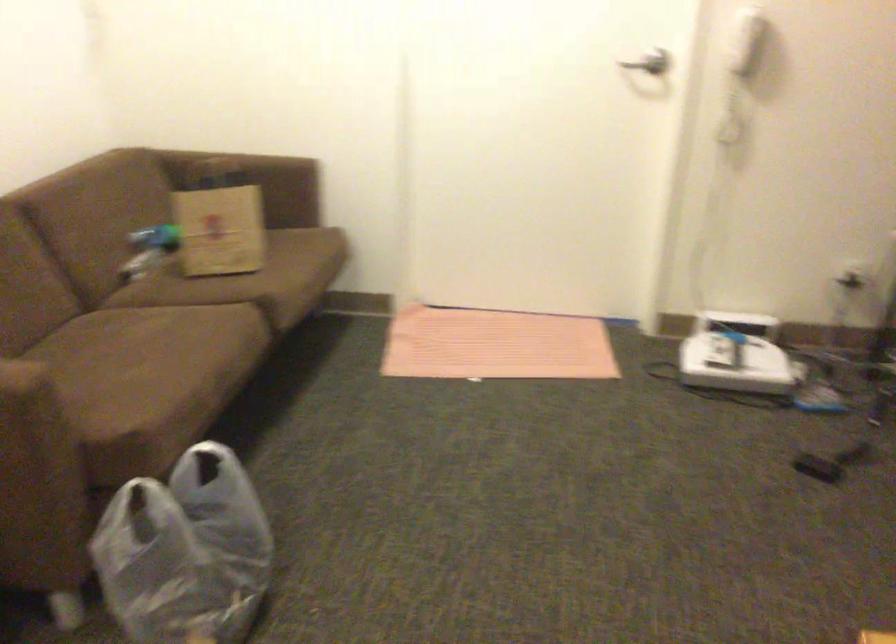
Where would you rest the brown sofa armrest? Please return your answer as a coordinate pair (x, y).

(23, 242)